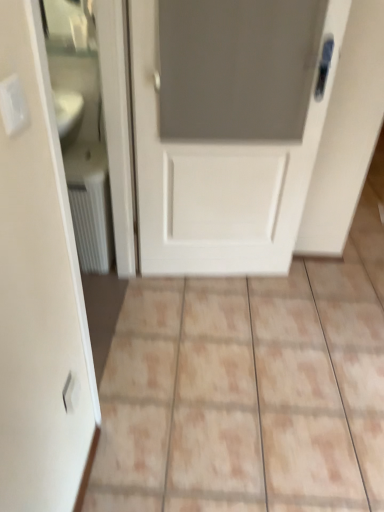
Identify the location of free space in front of white textured radiator at left. This screenshot has width=384, height=512. tap(107, 293).